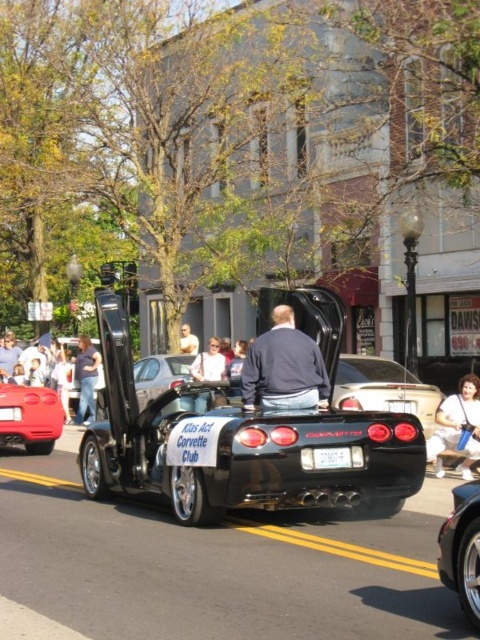
Question: Does shiny black convertible at center appear on the left side of white plastic license plate at center?

Choices:
 (A) yes
 (B) no

Answer: (A)

Question: Does shiny silver car at center appear over white plastic license plate at center?

Choices:
 (A) no
 (B) yes

Answer: (B)

Question: Is shiny black convertible at center positioned in front of dark blue sweater at center?

Choices:
 (A) yes
 (B) no

Answer: (A)

Question: Which object is farther from the camera taking this photo?

Choices:
 (A) dark blue sweater at center
 (B) white cotton shirt at lower right

Answer: (B)

Question: Which point is farther to the camera?

Choices:
 (A) white plastic license plate at center
 (B) shiny black convertible at center

Answer: (A)

Question: Among these objects, which one is farthest from the camera?

Choices:
 (A) white cotton shirt at lower right
 (B) black glossy convertible at center

Answer: (A)